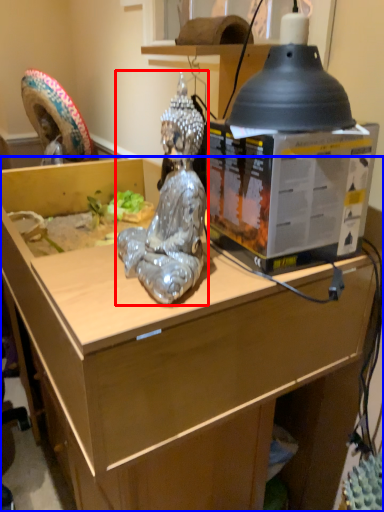
Question: Among these objects, which one is nearest to the camera, person (highlighted by a red box) or desk (highlighted by a blue box)?

Choices:
 (A) person
 (B) desk

Answer: (A)